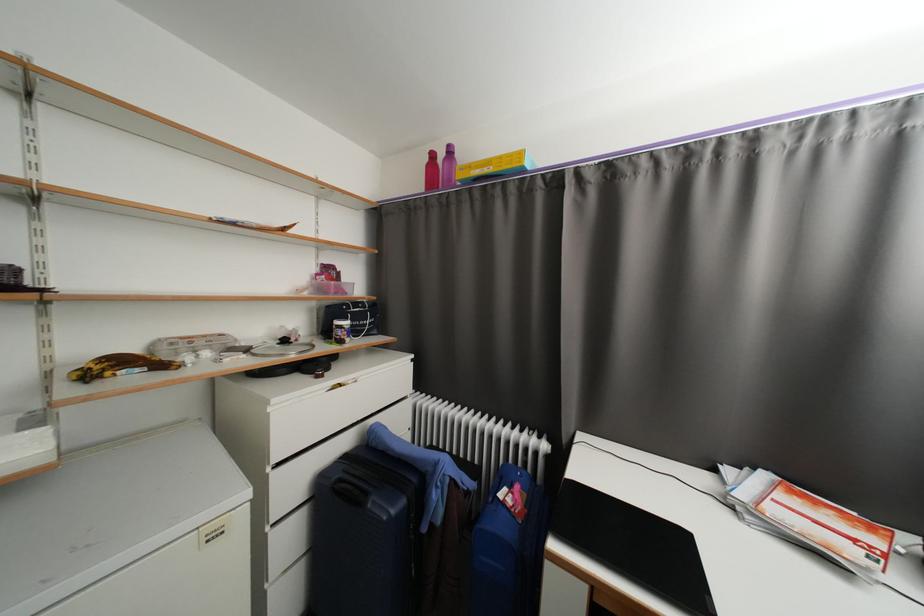
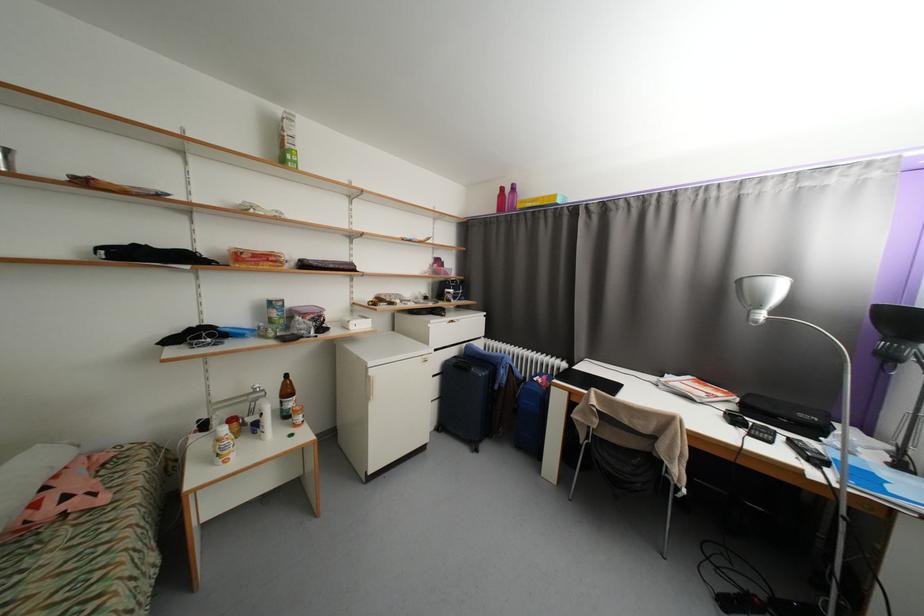
Locate, in the second image, the point that corresponds to pixel 439 156 in the first image.

(508, 190)